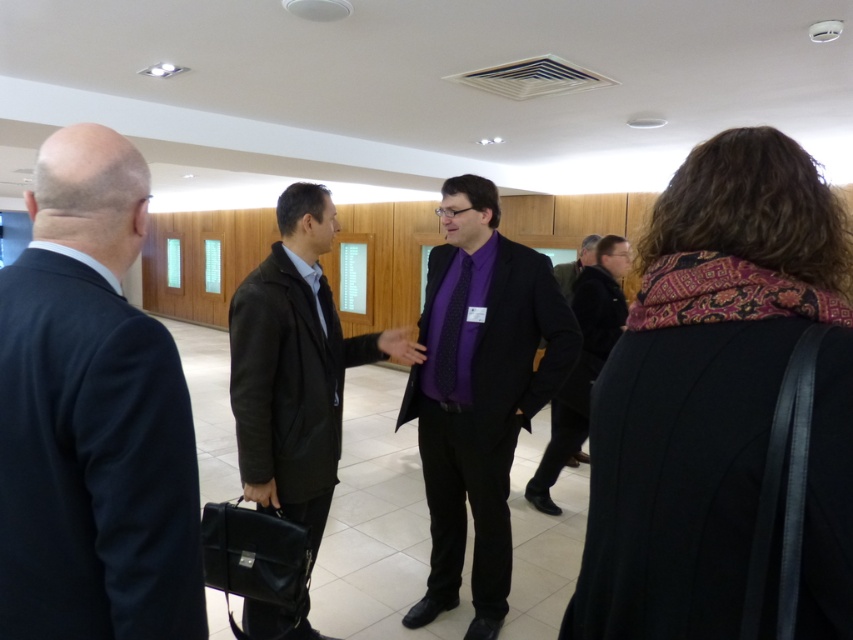
Question: Which object is closer to the camera taking this photo?

Choices:
 (A) dark blue suit at left
 (B) matte black suit at center
 (C) dark brown leather jacket at center

Answer: (A)

Question: Considering the relative positions of matte black suit at center and dark brown leather jacket at center in the image provided, where is matte black suit at center located with respect to dark brown leather jacket at center?

Choices:
 (A) right
 (B) left

Answer: (A)

Question: Is matte black suit at center bigger than dark brown leather jacket at center?

Choices:
 (A) no
 (B) yes

Answer: (A)

Question: Which of the following is the farthest from the observer?

Choices:
 (A) dark blue suit at left
 (B) matte black suit at center
 (C) purple woven tie at center

Answer: (C)

Question: Which is nearer to the purple matte suit at center?

Choices:
 (A) purple woven tie at center
 (B) dark blue suit at left
 (C) dark brown leather jacket at center
 (D) matte black suit at center

Answer: (D)

Question: Is dark blue suit at left below purple matte suit at center?

Choices:
 (A) yes
 (B) no

Answer: (B)